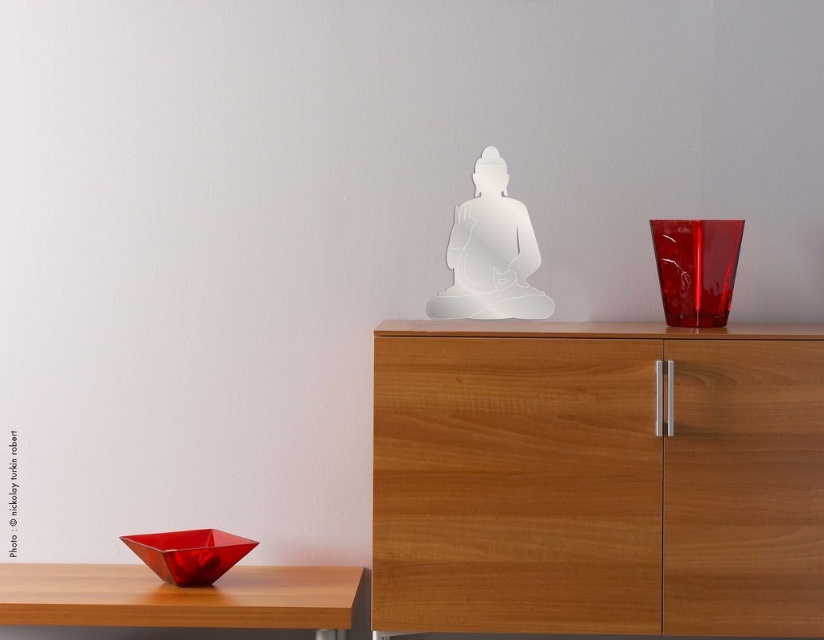
You are an interior designer planning to place a new decorative item between the wooden table at lower left and the transparent glass buddha at center. Considering their sizes, which object should you use as a reference for spacing to ensure the new item fits appropriately?

The wooden table at lower left is larger in size than the transparent glass buddha at center, so you should use the wooden table at lower left as the reference for spacing to accommodate the new decorative item.